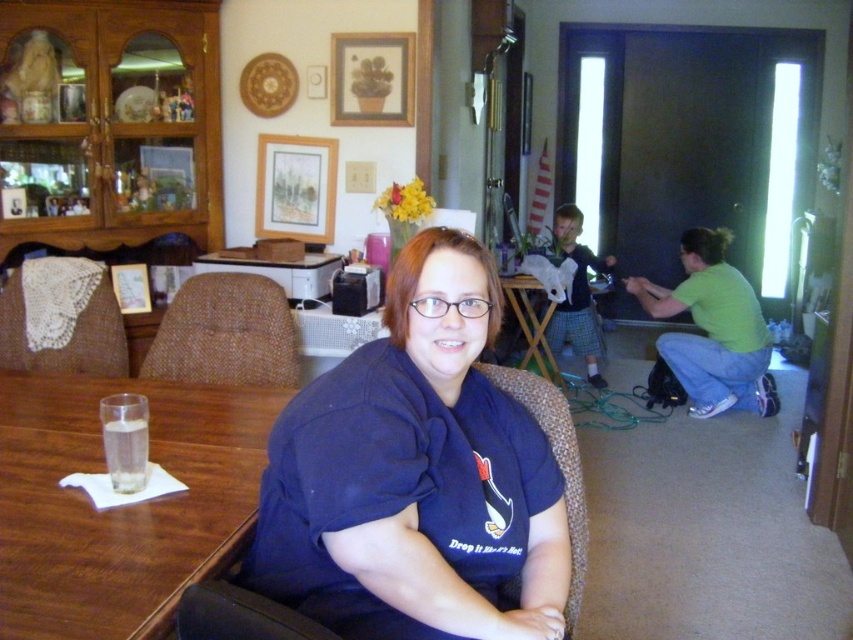
Question: Which point appears farthest from the camera in this image?

Choices:
 (A) (4, 288)
 (B) (363, 61)
 (C) (273, 371)
 (D) (583, 269)

Answer: (D)

Question: Which object appears farthest from the camera in this image?

Choices:
 (A) plaid fabric robe at center
 (B) green cotton shirt at lower right
 (C) transparent glass at lower left
 (D) matte wooden picture frame at upper center

Answer: (A)

Question: From the image, what is the correct spatial relationship of green cotton shirt at lower right in relation to matte wooden picture frame at upper center?

Choices:
 (A) above
 (B) below

Answer: (B)

Question: Is the position of burlap-textured chair at center more distant than that of matte wooden picture frame at upper center?

Choices:
 (A) yes
 (B) no

Answer: (B)

Question: Is dark blue t-shirt at center closer to the viewer compared to transparent glass at lower left?

Choices:
 (A) yes
 (B) no

Answer: (B)

Question: Which point appears farthest from the camera in this image?

Choices:
 (A) (332, 221)
 (B) (109, 328)
 (C) (231, 314)

Answer: (A)